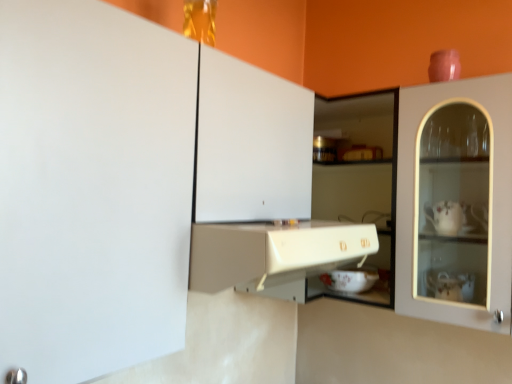
The height and width of the screenshot is (384, 512). Identify the location of matte white cabinet at center, placed as the 2th cabinetry when sorted from top to bottom. (273, 252).

In order to face matte white cabinet at center, placed as the 2th cabinetry when sorted from top to bottom, should I rotate leftwards or rightwards?

Turn left approximately 0.165 degrees to face it.

Describe the element at coordinates (351, 279) in the screenshot. I see `white glossy bowl at center` at that location.

The image size is (512, 384). Find the location of `matte white cabinet at center, arranged as the first cabinetry when ordered from the bottom`. matte white cabinet at center, arranged as the first cabinetry when ordered from the bottom is located at coordinates (273, 252).

Is matte white cabinet at center, placed as the 2th cabinetry when sorted from top to bottom, completely or partially inside white matte cabinet at upper left, the second cabinetry in the bottom-to-top sequence?

Yes, matte white cabinet at center, placed as the 2th cabinetry when sorted from top to bottom, is a part of white matte cabinet at upper left, the second cabinetry in the bottom-to-top sequence.

Based on the photo, from their relative heights in the image, would you say white matte cabinet at upper left, the second cabinetry in the bottom-to-top sequence, is taller or shorter than matte white cabinet at center, placed as the 2th cabinetry when sorted from top to bottom?

white matte cabinet at upper left, the second cabinetry in the bottom-to-top sequence, is taller than matte white cabinet at center, placed as the 2th cabinetry when sorted from top to bottom.

From a real-world perspective, between white matte cabinet at upper left, the second cabinetry in the bottom-to-top sequence, and matte white cabinet at center, arranged as the first cabinetry when ordered from the bottom, who is vertically lower?

matte white cabinet at center, arranged as the first cabinetry when ordered from the bottom, from a real-world perspective.

From the image's perspective, relative to matte white cabinet at center, placed as the 2th cabinetry when sorted from top to bottom, is white matte cabinet at upper left, acting as the 1th cabinetry starting from the top, above or below?

Clearly, from the image's perspective, white matte cabinet at upper left, acting as the 1th cabinetry starting from the top, is above matte white cabinet at center, placed as the 2th cabinetry when sorted from top to bottom.

Considering the sizes of objects matte white cabinet at center, placed as the 2th cabinetry when sorted from top to bottom, and white glossy bowl at center in the image provided, who is taller, matte white cabinet at center, placed as the 2th cabinetry when sorted from top to bottom, or white glossy bowl at center?

With more height is matte white cabinet at center, placed as the 2th cabinetry when sorted from top to bottom.

Identify the location of appliance below the matte white cabinet at center, arranged as the first cabinetry when ordered from the bottom (from a real-world perspective). The height and width of the screenshot is (384, 512). (351, 279).

What's the angular difference between matte white cabinet at center, arranged as the first cabinetry when ordered from the bottom, and white glossy bowl at center's facing directions?

The facing directions of matte white cabinet at center, arranged as the first cabinetry when ordered from the bottom, and white glossy bowl at center are 87.6 degrees apart.

Can you confirm if matte white cabinet at center, arranged as the first cabinetry when ordered from the bottom, is positioned to the left of white glossy bowl at center?

Yes, matte white cabinet at center, arranged as the first cabinetry when ordered from the bottom, is to the left of white glossy bowl at center.

Looking at this image, how distant is white matte cabinet at upper left, the second cabinetry in the bottom-to-top sequence, from white glossy bowl at center?

The distance of white matte cabinet at upper left, the second cabinetry in the bottom-to-top sequence, from white glossy bowl at center is 31.53 inches.

In terms of width, does white matte cabinet at upper left, acting as the 1th cabinetry starting from the top, look wider or thinner when compared to white glossy bowl at center?

In the image, white matte cabinet at upper left, acting as the 1th cabinetry starting from the top, appears to be wider than white glossy bowl at center.

Is the surface of white matte cabinet at upper left, acting as the 1th cabinetry starting from the top, in direct contact with white glossy bowl at center?

No.

From a real-world perspective, count 2nd cabinetrys upward from the white glossy bowl at center and point to it. Please provide its 2D coordinates.

[(92, 188)]

Considering the relative positions of white glossy bowl at center and white matte cabinet at upper left, acting as the 1th cabinetry starting from the top, in the image provided, is white glossy bowl at center to the right of white matte cabinet at upper left, acting as the 1th cabinetry starting from the top, from the viewer's perspective?

Yes.

Does white glossy bowl at center have a lesser height compared to white matte cabinet at upper left, the second cabinetry in the bottom-to-top sequence?

Indeed, white glossy bowl at center has a lesser height compared to white matte cabinet at upper left, the second cabinetry in the bottom-to-top sequence.

Is white glossy bowl at center situated inside white matte cabinet at upper left, the second cabinetry in the bottom-to-top sequence, or outside?

white glossy bowl at center lies outside white matte cabinet at upper left, the second cabinetry in the bottom-to-top sequence.

Is white glossy bowl at center smaller than white matte cabinet at upper left, acting as the 1th cabinetry starting from the top?

Yes, white glossy bowl at center is smaller than white matte cabinet at upper left, acting as the 1th cabinetry starting from the top.

Is matte white cabinet at center, placed as the 2th cabinetry when sorted from top to bottom, with white matte cabinet at upper left, acting as the 1th cabinetry starting from the top?

matte white cabinet at center, placed as the 2th cabinetry when sorted from top to bottom, is not next to white matte cabinet at upper left, acting as the 1th cabinetry starting from the top, and they're not touching.

What's the angular difference between matte white cabinet at center, placed as the 2th cabinetry when sorted from top to bottom, and white matte cabinet at upper left, acting as the 1th cabinetry starting from the top,'s facing directions?

The angular difference between matte white cabinet at center, placed as the 2th cabinetry when sorted from top to bottom, and white matte cabinet at upper left, acting as the 1th cabinetry starting from the top, is 0.779 degrees.

In the image, is matte white cabinet at center, placed as the 2th cabinetry when sorted from top to bottom, positioned in front of or behind white matte cabinet at upper left, acting as the 1th cabinetry starting from the top?

Visually, matte white cabinet at center, placed as the 2th cabinetry when sorted from top to bottom, is located behind white matte cabinet at upper left, acting as the 1th cabinetry starting from the top.

From a real-world perspective, who is located higher, matte white cabinet at center, arranged as the first cabinetry when ordered from the bottom, or white matte cabinet at upper left, acting as the 1th cabinetry starting from the top?

white matte cabinet at upper left, acting as the 1th cabinetry starting from the top.

Could you tell me if white glossy bowl at center is facing matte white cabinet at center, placed as the 2th cabinetry when sorted from top to bottom?

Yes, white glossy bowl at center is aimed at matte white cabinet at center, placed as the 2th cabinetry when sorted from top to bottom.

Is white glossy bowl at center taller or shorter than matte white cabinet at center, arranged as the first cabinetry when ordered from the bottom?

white glossy bowl at center is shorter than matte white cabinet at center, arranged as the first cabinetry when ordered from the bottom.

Considering the relative sizes of white glossy bowl at center and matte white cabinet at center, placed as the 2th cabinetry when sorted from top to bottom, in the image provided, is white glossy bowl at center smaller than matte white cabinet at center, placed as the 2th cabinetry when sorted from top to bottom,?

Yes.

From a real-world perspective, is white glossy bowl at center above or below matte white cabinet at center, arranged as the first cabinetry when ordered from the bottom?

From a real-world perspective, white glossy bowl at center is physically below matte white cabinet at center, arranged as the first cabinetry when ordered from the bottom.

The image size is (512, 384). I want to click on cabinetry positioned vertically above the matte white cabinet at center, placed as the 2th cabinetry when sorted from top to bottom (from a real-world perspective), so click(x=92, y=188).

Identify the location of appliance on the right of matte white cabinet at center, placed as the 2th cabinetry when sorted from top to bottom. The width and height of the screenshot is (512, 384). (351, 279).

Based on their spatial positions, is white matte cabinet at upper left, acting as the 1th cabinetry starting from the top, or matte white cabinet at center, arranged as the first cabinetry when ordered from the bottom, closer to white glossy bowl at center?

Among the two, matte white cabinet at center, arranged as the first cabinetry when ordered from the bottom, is located nearer to white glossy bowl at center.

Looking at this image, when comparing their distances from white matte cabinet at upper left, acting as the 1th cabinetry starting from the top, does matte white cabinet at center, arranged as the first cabinetry when ordered from the bottom, or white glossy bowl at center seem further?

Among the two, white glossy bowl at center is located further to white matte cabinet at upper left, acting as the 1th cabinetry starting from the top.

Which object lies nearer to the anchor point white matte cabinet at upper left, acting as the 1th cabinetry starting from the top, white glossy bowl at center or matte white cabinet at center, arranged as the first cabinetry when ordered from the bottom?

matte white cabinet at center, arranged as the first cabinetry when ordered from the bottom, lies closer to white matte cabinet at upper left, acting as the 1th cabinetry starting from the top, than the other object.

Considering their positions, is white glossy bowl at center positioned further to matte white cabinet at center, placed as the 2th cabinetry when sorted from top to bottom, than white matte cabinet at upper left, acting as the 1th cabinetry starting from the top?

white glossy bowl at center.

When comparing their distances from matte white cabinet at center, placed as the 2th cabinetry when sorted from top to bottom, does white matte cabinet at upper left, the second cabinetry in the bottom-to-top sequence, or white glossy bowl at center seem further?

white glossy bowl at center is positioned further to the anchor matte white cabinet at center, placed as the 2th cabinetry when sorted from top to bottom.

Based on their spatial positions, is matte white cabinet at center, arranged as the first cabinetry when ordered from the bottom, or white matte cabinet at upper left, the second cabinetry in the bottom-to-top sequence, closer to white glossy bowl at center?

matte white cabinet at center, arranged as the first cabinetry when ordered from the bottom.

Identify the location of cabinetry positioned between white matte cabinet at upper left, acting as the 1th cabinetry starting from the top, and white glossy bowl at center from near to far. (273, 252).